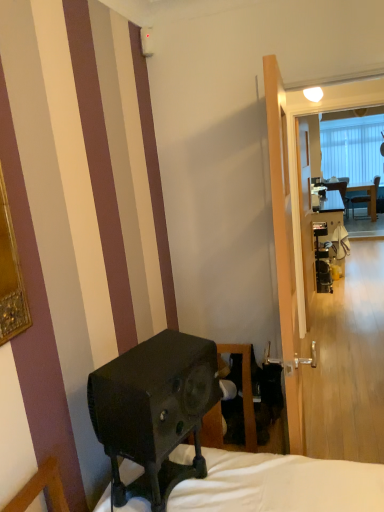
Question: From the image's perspective, is matte black desk at center positioned above or below clear glass screen door at center, which ranks as the 2th screen door in left-to-right order?

Choices:
 (A) above
 (B) below

Answer: (B)

Question: Would you say matte black desk at center is to the left or to the right of clear glass screen door at center, which ranks as the 2th screen door in left-to-right order, in the picture?

Choices:
 (A) right
 (B) left

Answer: (A)

Question: Which of these objects is positioned closest to the black matte speaker at lower left?

Choices:
 (A) matte black desk at center
 (B) transparent glass screen door at center, the second screen door in the right-to-left sequence
 (C) clear glass screen door at center, which appears as the first screen door when viewed from the back

Answer: (B)

Question: Estimate the real-world distances between objects in this image. Which object is closer to the clear glass screen door at center, which ranks as the 2th screen door in left-to-right order?

Choices:
 (A) transparent glass screen door at center, the second screen door in the right-to-left sequence
 (B) black matte speaker at lower left
 (C) matte black desk at center

Answer: (C)